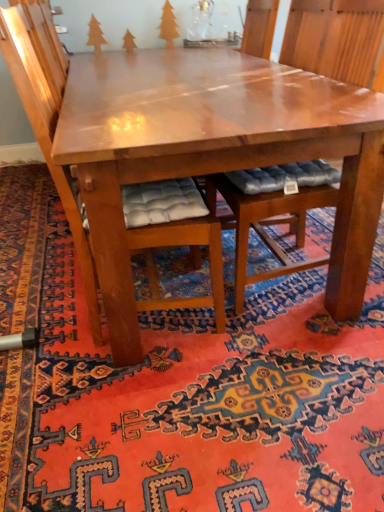
Question: Which direction should I rotate to look at matte brown tree at upper center, which ranks as the second tree in left-to-right order?

Choices:
 (A) right
 (B) left

Answer: (B)

Question: Is shiny brown table at center looking in the opposite direction of carpet with intricate patterns at center?

Choices:
 (A) yes
 (B) no

Answer: (B)

Question: From a real-world perspective, is shiny brown table at center below carpet with intricate patterns at center?

Choices:
 (A) no
 (B) yes

Answer: (A)

Question: Does shiny brown table at center have a larger size compared to carpet with intricate patterns at center?

Choices:
 (A) yes
 (B) no

Answer: (A)

Question: Could you tell me if shiny brown table at center is facing carpet with intricate patterns at center?

Choices:
 (A) yes
 (B) no

Answer: (B)

Question: Are shiny brown table at center and carpet with intricate patterns at center making contact?

Choices:
 (A) no
 (B) yes

Answer: (A)

Question: Does shiny brown table at center have a smaller size compared to carpet with intricate patterns at center?

Choices:
 (A) no
 (B) yes

Answer: (A)

Question: Could you tell me if wooden cushioned chair at center, arranged as the first chair when viewed from the right, is facing wooden tree at upper left, which is the first tree in left-to-right order?

Choices:
 (A) yes
 (B) no

Answer: (B)

Question: From a real-world perspective, does wooden cushioned chair at center, which appears as the 2th chair when viewed from the left, sit lower than wooden tree at upper left, the third tree when ordered from right to left?

Choices:
 (A) no
 (B) yes

Answer: (B)

Question: From the image's perspective, is wooden cushioned chair at center, arranged as the first chair when viewed from the right, under wooden tree at upper left, the third tree when ordered from right to left?

Choices:
 (A) yes
 (B) no

Answer: (A)

Question: Is wooden tree at upper left, the third tree when ordered from right to left, at the back of wooden cushioned chair at center, which appears as the 2th chair when viewed from the left?

Choices:
 (A) no
 (B) yes

Answer: (A)

Question: Is wooden cushioned chair at center, arranged as the first chair when viewed from the right, taller than wooden tree at upper left, the third tree when ordered from right to left?

Choices:
 (A) no
 (B) yes

Answer: (B)

Question: Is wooden cushioned chair at center, which appears as the 2th chair when viewed from the left, bigger than wooden tree at upper left, which is the first tree in left-to-right order?

Choices:
 (A) yes
 (B) no

Answer: (A)

Question: Is wooden tree at upper left, the third tree when ordered from right to left, looking in the opposite direction of wooden cushioned chair at center, the first chair in the left-to-right sequence?

Choices:
 (A) yes
 (B) no

Answer: (B)